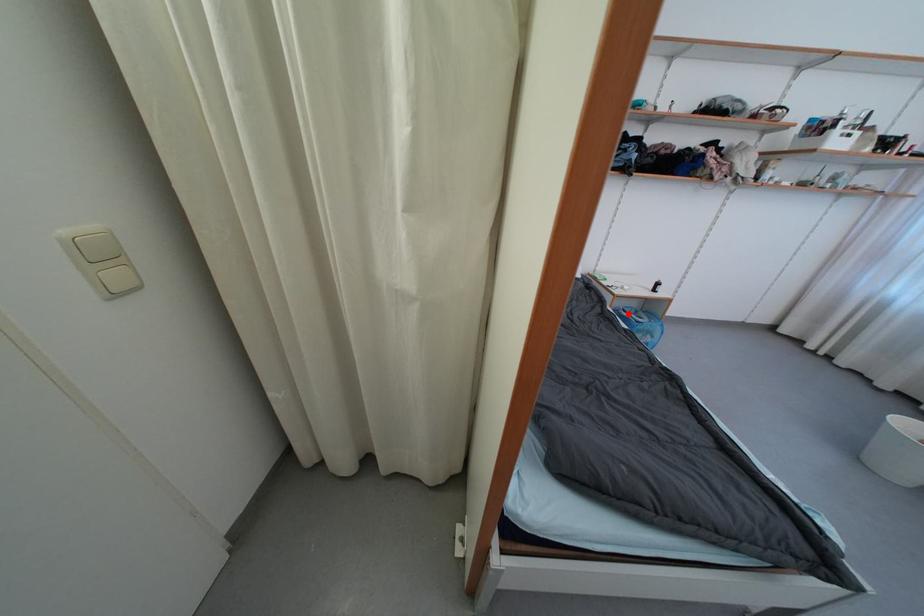
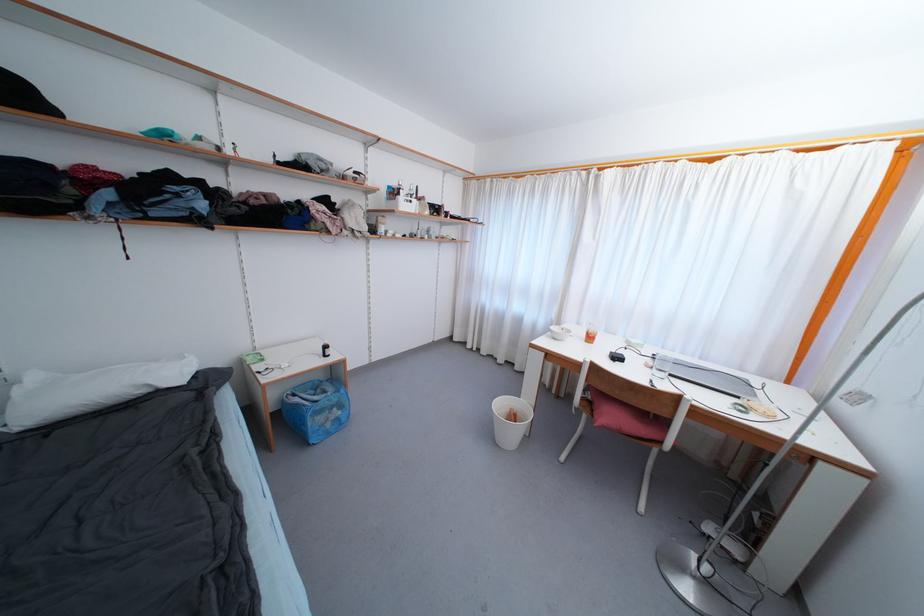
Question: I am providing you with two images of the same scene from different viewpoints. Image1 has a red point marked. In image2, the corresponding 3D location appears at what relative position? Reply with the corresponding letter.

Choices:
 (A) Closer
 (B) Farther

Answer: (A)